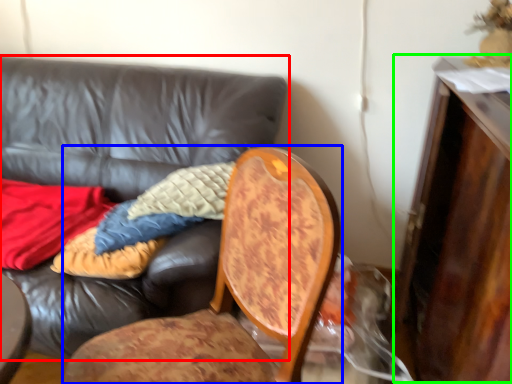
Question: Estimate the real-world distances between objects in this image. Which object is farther from studio couch (highlighted by a red box), chair (highlighted by a blue box) or dresser (highlighted by a green box)?

Choices:
 (A) chair
 (B) dresser

Answer: (B)